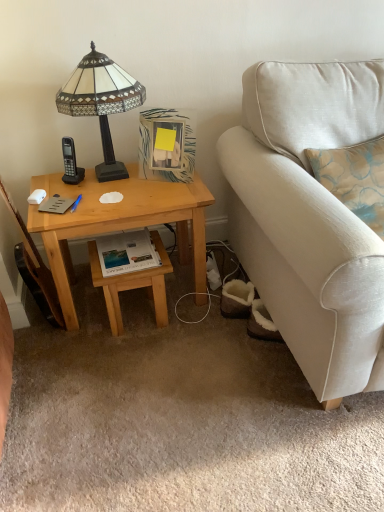
Find the location of a particular element. This screenshot has height=512, width=384. vacant space to the right of light wood stool at lower center is located at coordinates (205, 323).